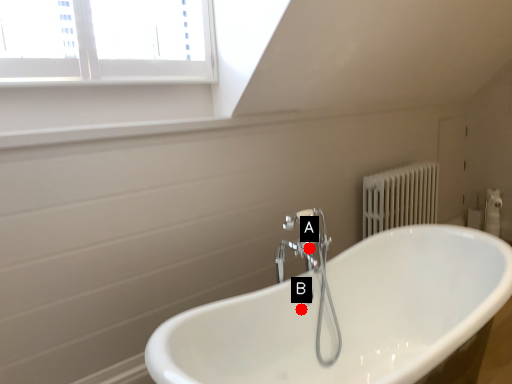
Question: Two points are circled on the image, labeled by A and B beside each circle. Which point is farther from the camera taking this photo?

Choices:
 (A) A is further
 (B) B is further

Answer: (A)